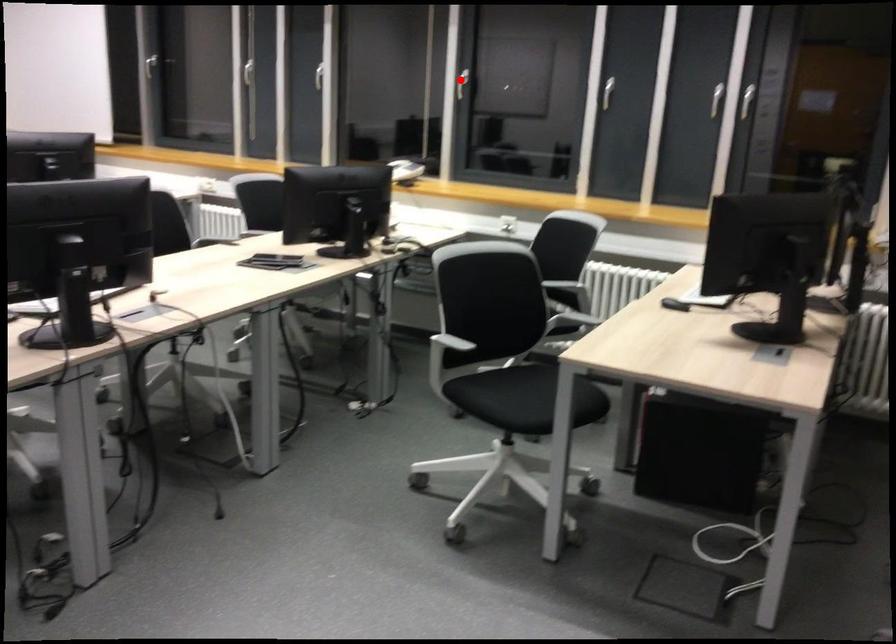
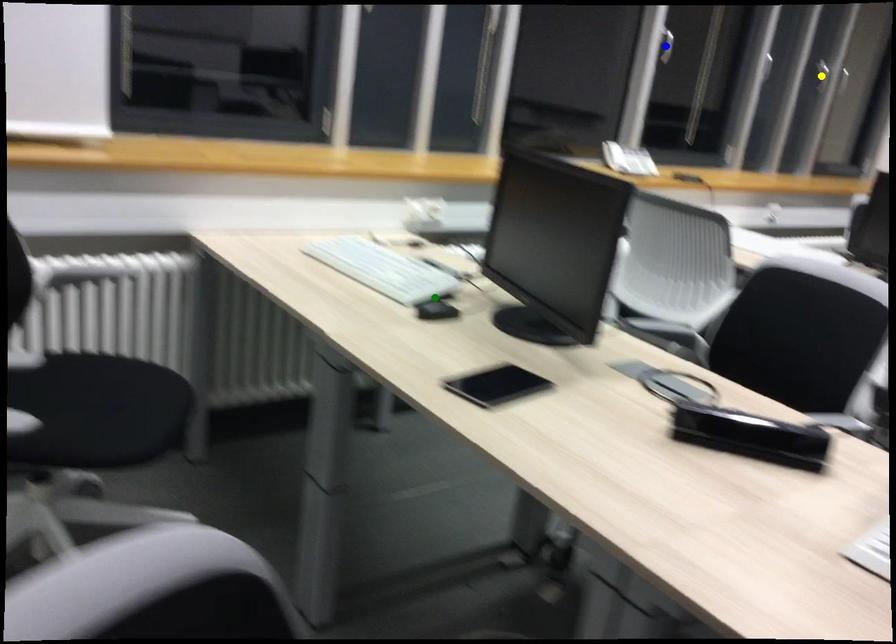
Question: I am providing you with two images of the same scene from different viewpoints. A red point is marked on the first image. You are given multiple points on the second image. Which spot in image 2 lines up with the point in image 1?

Choices:
 (A) yellow point
 (B) blue point
 (C) green point

Answer: (B)